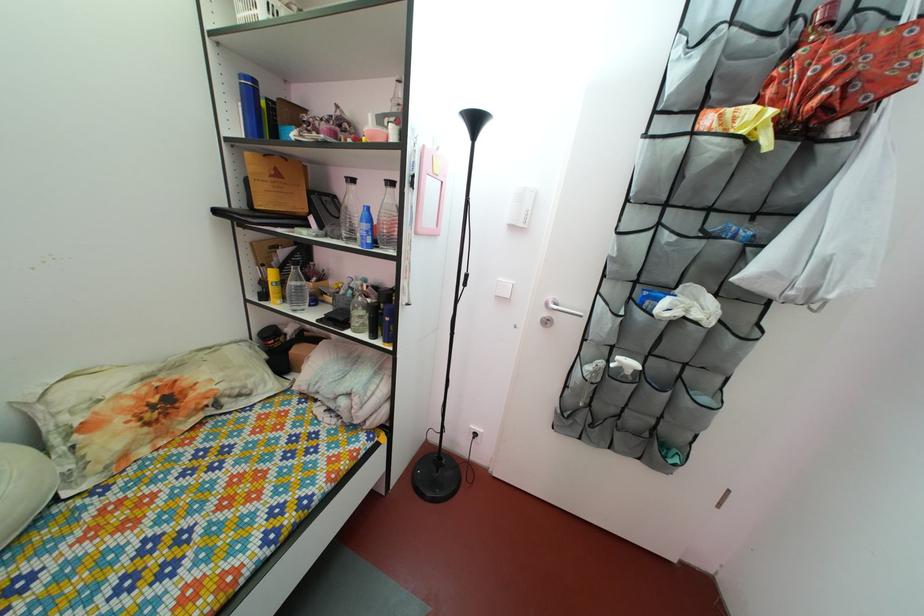
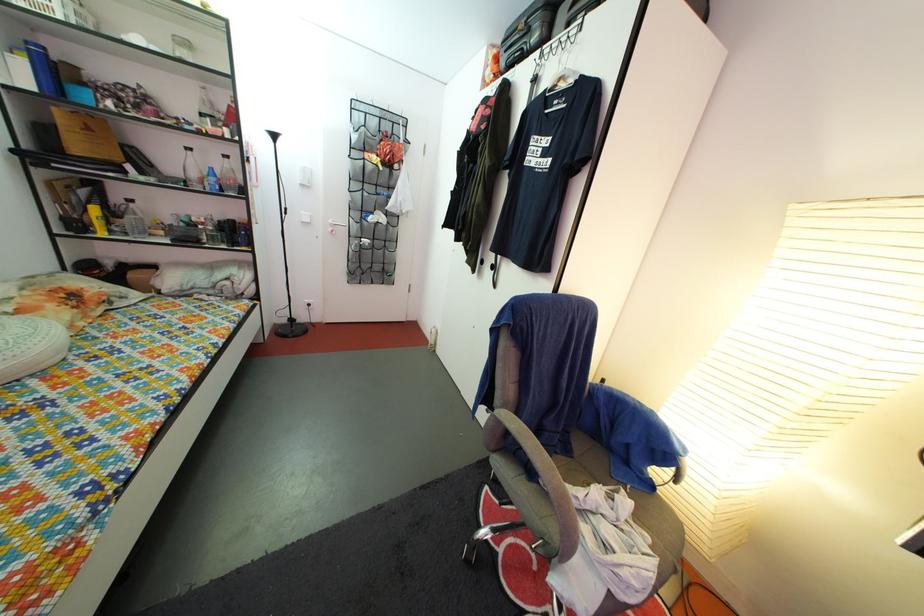
Locate, in the second image, the point that corresponds to point (256, 163) in the first image.

(64, 118)